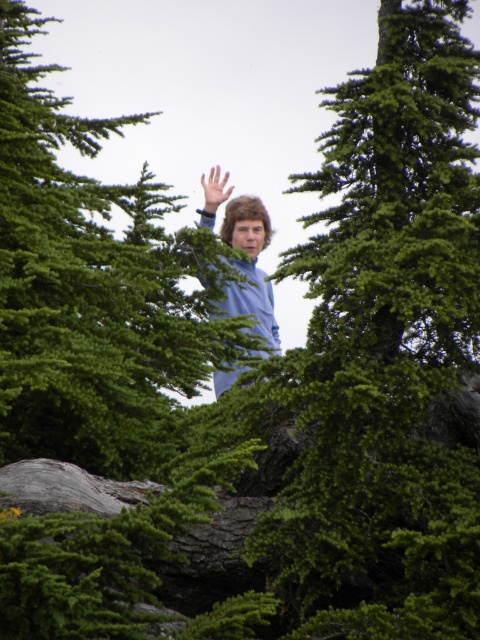
You are a photographer trying to capture the smooth skin hand at center in a clear shot. Considering the green textured tree at center is blocking part of the view, can you estimate if the hand will be mostly visible or mostly obscured?

The green textured tree at center has a larger size compared to smooth skin hand at center, so the hand may be mostly obscured by the tree.

You are a photographer trying to capture the smooth skin hand at center in a photo. The green textured tree at center is blocking part of the hand. Can you tell me if the tree is wider than the hand?

The green textured tree at center is wider than the smooth skin hand at center, so the tree is blocking more of the hand because of its greater width.